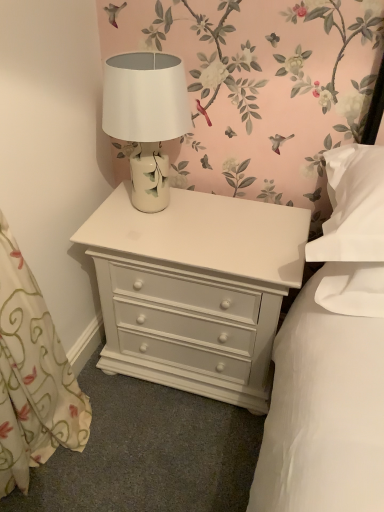
Question: Is white ceramic table lamp at center situated inside white painted wood nightstand at center or outside?

Choices:
 (A) outside
 (B) inside

Answer: (A)

Question: Relative to white painted wood nightstand at center, is white ceramic table lamp at center in front or behind?

Choices:
 (A) front
 (B) behind

Answer: (A)

Question: From a real-world perspective, is white ceramic table lamp at center physically located above or below white painted wood nightstand at center?

Choices:
 (A) above
 (B) below

Answer: (A)

Question: From the image's perspective, is white painted wood nightstand at center above or below white ceramic table lamp at center?

Choices:
 (A) above
 (B) below

Answer: (B)

Question: In terms of height, does white painted wood nightstand at center look taller or shorter compared to white ceramic table lamp at center?

Choices:
 (A) tall
 (B) short

Answer: (A)

Question: Considering the positions of white painted wood nightstand at center and white ceramic table lamp at center in the image, is white painted wood nightstand at center bigger or smaller than white ceramic table lamp at center?

Choices:
 (A) small
 (B) big

Answer: (B)

Question: Does point (109, 358) appear closer or farther from the camera than point (137, 164)?

Choices:
 (A) farther
 (B) closer

Answer: (A)